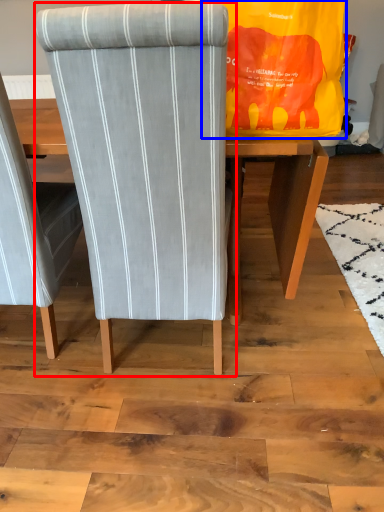
Question: Which point is further to the camera, chair (highlighted by a red box) or bag (highlighted by a blue box)?

Choices:
 (A) chair
 (B) bag

Answer: (B)